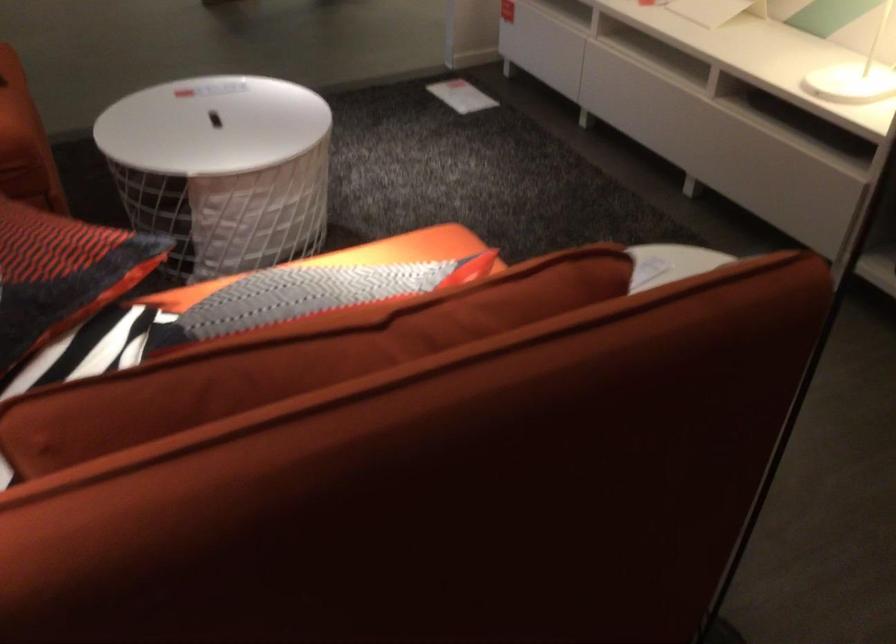
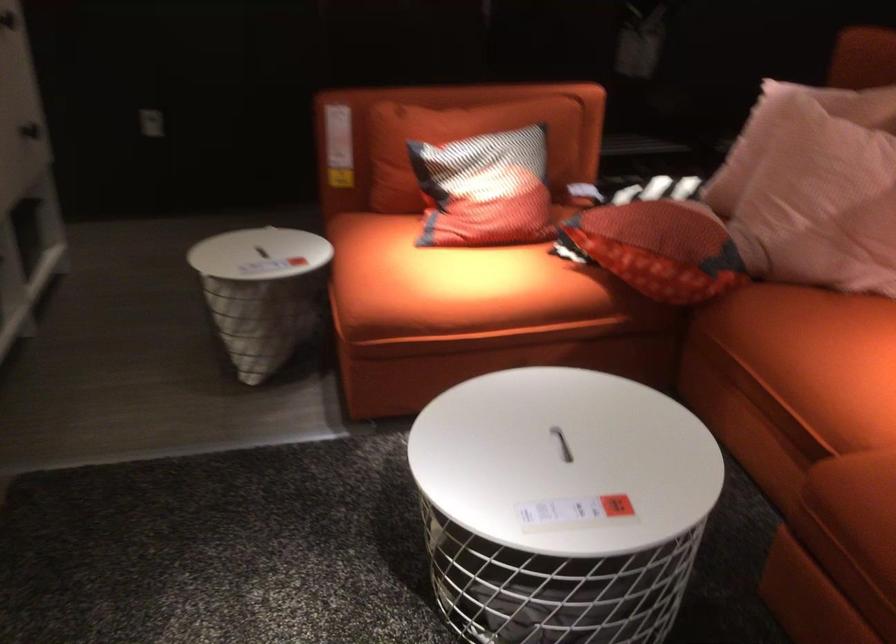
Where in the second image is the point corresponding to pixel 200 131 from the first image?

(562, 444)